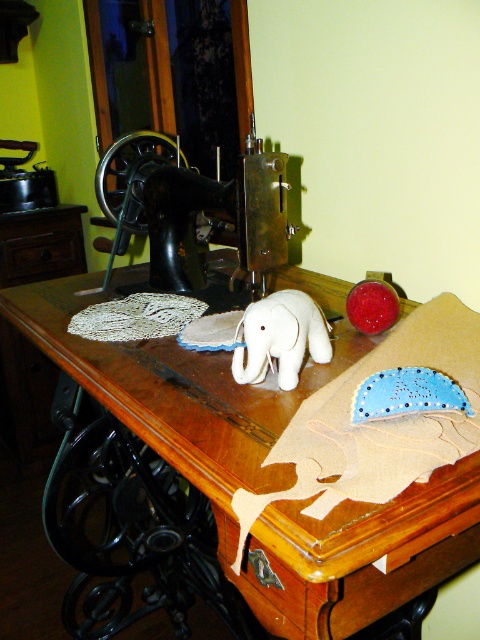
You are organizing a childrens craft activity and need to place the wooden sewing machine at center and the white plush elephant at center on a table. According to the image, which object is positioned higher up?

The white plush elephant at center is positioned higher up than the wooden sewing machine at center.

You are a delivery person who needs to place a box that is 12 inches wide on the table between the wooden sewing machine at center and the black metal sewing machine at center. Can the box fit in that space?

The distance between the wooden sewing machine at center and the black metal sewing machine at center is 12.39 inches, so the box that is 12 inches wide can fit in that space since it is slightly narrower than the available space.

Consider the image. You are standing in front of the table with the black metal sewing machine at center and the white plush elephant at center. Which object is closer to you?

The black metal sewing machine at center is closer to you than the white plush elephant at center.